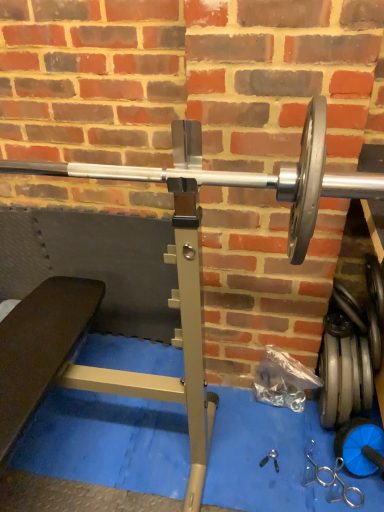
Find the location of a particular element. Image resolution: width=384 pixels, height=512 pixels. silver metallic barbell at center is located at coordinates pyautogui.click(x=241, y=175).

Can you confirm if blue rubber dumbbell at lower right, the second dumbbell viewed from the top, is shorter than silver metallic barbell at center?

Indeed, blue rubber dumbbell at lower right, the second dumbbell viewed from the top, has a lesser height compared to silver metallic barbell at center.

Where is `the 2nd dumbbell to the right of the silver metallic barbell at center, counting from the anchor's position`? the 2nd dumbbell to the right of the silver metallic barbell at center, counting from the anchor's position is located at coordinates (360, 446).

Is blue rubber dumbbell at lower right, arranged as the first dumbbell when ordered from the bottom, not inside silver metallic barbell at center?

That's correct, blue rubber dumbbell at lower right, arranged as the first dumbbell when ordered from the bottom, is outside of silver metallic barbell at center.

Between blue rubber dumbbell at lower right, arranged as the first dumbbell when ordered from the bottom, and silver metallic barbell at center, which one has smaller size?

With smaller size is blue rubber dumbbell at lower right, arranged as the first dumbbell when ordered from the bottom.

Is blue rubber dumbbell at lower right, the second dumbbell viewed from the top, positioned far away from silver metallic dumbbell at lower right, the second dumbbell ordered from the bottom?

That's not correct — blue rubber dumbbell at lower right, the second dumbbell viewed from the top, is a little close to silver metallic dumbbell at lower right, the second dumbbell ordered from the bottom.

Does blue rubber dumbbell at lower right, arranged as the first dumbbell when ordered from the bottom, have a greater width compared to silver metallic dumbbell at lower right, placed as the first dumbbell when sorted from top to bottom?

No.

From the picture: Is blue rubber dumbbell at lower right, the second dumbbell viewed from the top, oriented away from silver metallic dumbbell at lower right, the second dumbbell ordered from the bottom?

Absolutely, blue rubber dumbbell at lower right, the second dumbbell viewed from the top, is directed away from silver metallic dumbbell at lower right, the second dumbbell ordered from the bottom.

Looking at this image, is blue rubber dumbbell at lower right, the second dumbbell viewed from the top, in front of or behind silver metallic dumbbell at lower right, the second dumbbell ordered from the bottom, in the image?

Visually, blue rubber dumbbell at lower right, the second dumbbell viewed from the top, is located in front of silver metallic dumbbell at lower right, the second dumbbell ordered from the bottom.

Considering the relative sizes of silver metallic barbell at center and blue rubber dumbbell at lower right, arranged as the first dumbbell when ordered from the bottom, in the image provided, is silver metallic barbell at center smaller than blue rubber dumbbell at lower right, arranged as the first dumbbell when ordered from the bottom,?

Actually, silver metallic barbell at center might be larger than blue rubber dumbbell at lower right, arranged as the first dumbbell when ordered from the bottom.

Can you confirm if silver metallic barbell at center is shorter than blue rubber dumbbell at lower right, arranged as the first dumbbell when ordered from the bottom?

No.

From the image's perspective, which is above, silver metallic barbell at center or blue rubber dumbbell at lower right, the second dumbbell viewed from the top?

silver metallic barbell at center appears higher in the image.

Which point is more forward, (268, 186) or (377, 450)?

The point (268, 186) is more forward.

From a real-world perspective, is silver metallic dumbbell at lower right, the second dumbbell ordered from the bottom, positioned above or below silver metallic barbell at center?

In terms of real-world spatial position, silver metallic dumbbell at lower right, the second dumbbell ordered from the bottom, is below silver metallic barbell at center.

Can you confirm if silver metallic dumbbell at lower right, the second dumbbell ordered from the bottom, is smaller than silver metallic barbell at center?

Yes, silver metallic dumbbell at lower right, the second dumbbell ordered from the bottom, is smaller than silver metallic barbell at center.

Is the surface of silver metallic dumbbell at lower right, placed as the first dumbbell when sorted from top to bottom, in direct contact with silver metallic barbell at center?

silver metallic dumbbell at lower right, placed as the first dumbbell when sorted from top to bottom, is not next to silver metallic barbell at center, and they're not touching.

Considering the positions of objects silver metallic dumbbell at lower right, placed as the first dumbbell when sorted from top to bottom, and silver metallic barbell at center in the image provided, who is more to the right, silver metallic dumbbell at lower right, placed as the first dumbbell when sorted from top to bottom, or silver metallic barbell at center?

From the viewer's perspective, silver metallic dumbbell at lower right, placed as the first dumbbell when sorted from top to bottom, appears more on the right side.

Considering the relative sizes of silver metallic barbell at center and silver metallic dumbbell at lower right, placed as the first dumbbell when sorted from top to bottom, in the image provided, is silver metallic barbell at center bigger than silver metallic dumbbell at lower right, placed as the first dumbbell when sorted from top to bottom,?

Yes, silver metallic barbell at center is bigger than silver metallic dumbbell at lower right, placed as the first dumbbell when sorted from top to bottom.

Is silver metallic barbell at center far from silver metallic dumbbell at lower right, the second dumbbell ordered from the bottom?

Actually, silver metallic barbell at center and silver metallic dumbbell at lower right, the second dumbbell ordered from the bottom, are a little close together.

Does point (165, 181) appear closer or farther from the camera than point (368, 370)?

Point (165, 181) appears to be closer to the viewer than point (368, 370).

Which object is closer to the camera, silver metallic barbell at center or silver metallic dumbbell at lower right, the second dumbbell ordered from the bottom?

silver metallic barbell at center is more forward.

Is silver metallic dumbbell at lower right, placed as the first dumbbell when sorted from top to bottom, with blue rubber dumbbell at lower right, arranged as the first dumbbell when ordered from the bottom?

No, silver metallic dumbbell at lower right, placed as the first dumbbell when sorted from top to bottom, is not in contact with blue rubber dumbbell at lower right, arranged as the first dumbbell when ordered from the bottom.

Is silver metallic dumbbell at lower right, placed as the first dumbbell when sorted from top to bottom, spatially inside blue rubber dumbbell at lower right, the second dumbbell viewed from the top, or outside of it?

silver metallic dumbbell at lower right, placed as the first dumbbell when sorted from top to bottom, cannot be found inside blue rubber dumbbell at lower right, the second dumbbell viewed from the top.

Can you confirm if silver metallic dumbbell at lower right, placed as the first dumbbell when sorted from top to bottom, is bigger than blue rubber dumbbell at lower right, arranged as the first dumbbell when ordered from the bottom?

Yes, silver metallic dumbbell at lower right, placed as the first dumbbell when sorted from top to bottom, is bigger than blue rubber dumbbell at lower right, arranged as the first dumbbell when ordered from the bottom.

The width and height of the screenshot is (384, 512). Identify the location of barbell lying above the blue rubber dumbbell at lower right, arranged as the first dumbbell when ordered from the bottom (from the image's perspective). (241, 175).

Where is `dumbbell in front of the silver metallic dumbbell at lower right, placed as the first dumbbell when sorted from top to bottom`? The image size is (384, 512). dumbbell in front of the silver metallic dumbbell at lower right, placed as the first dumbbell when sorted from top to bottom is located at coordinates (360, 446).

Estimate the real-world distances between objects in this image. Which object is closer to silver metallic barbell at center, silver metallic dumbbell at lower right, placed as the first dumbbell when sorted from top to bottom, or blue rubber dumbbell at lower right, the second dumbbell viewed from the top?

The object closer to silver metallic barbell at center is silver metallic dumbbell at lower right, placed as the first dumbbell when sorted from top to bottom.

Based on their spatial positions, is blue rubber dumbbell at lower right, arranged as the first dumbbell when ordered from the bottom, or silver metallic dumbbell at lower right, the second dumbbell ordered from the bottom, further from silver metallic barbell at center?

blue rubber dumbbell at lower right, arranged as the first dumbbell when ordered from the bottom, is positioned further to the anchor silver metallic barbell at center.

Which object lies further to the anchor point blue rubber dumbbell at lower right, the second dumbbell viewed from the top, silver metallic dumbbell at lower right, placed as the first dumbbell when sorted from top to bottom, or silver metallic barbell at center?

silver metallic barbell at center is positioned further to the anchor blue rubber dumbbell at lower right, the second dumbbell viewed from the top.

Based on the photo, from the image, which object appears to be nearer to silver metallic dumbbell at lower right, the second dumbbell ordered from the bottom, silver metallic barbell at center or blue rubber dumbbell at lower right, the second dumbbell viewed from the top?

The object closer to silver metallic dumbbell at lower right, the second dumbbell ordered from the bottom, is blue rubber dumbbell at lower right, the second dumbbell viewed from the top.

When comparing their distances from silver metallic dumbbell at lower right, the second dumbbell ordered from the bottom, does blue rubber dumbbell at lower right, the second dumbbell viewed from the top, or silver metallic barbell at center seem further?

The object further to silver metallic dumbbell at lower right, the second dumbbell ordered from the bottom, is silver metallic barbell at center.

When comparing their distances from blue rubber dumbbell at lower right, arranged as the first dumbbell when ordered from the bottom, does silver metallic barbell at center or silver metallic dumbbell at lower right, the second dumbbell ordered from the bottom, seem closer?

silver metallic dumbbell at lower right, the second dumbbell ordered from the bottom, is closer to blue rubber dumbbell at lower right, arranged as the first dumbbell when ordered from the bottom.

You are a GUI agent. You are given a task and a screenshot of the screen. Output one action in this format:
    pyautogui.click(x=<x>, y=<y>)
    Task: Click on the dumbbell between silver metallic barbell at center and blue rubber dumbbell at lower right, arranged as the first dumbbell when ordered from the bottom, vertically
    This screenshot has height=512, width=384.
    Given the screenshot: What is the action you would take?
    pyautogui.click(x=351, y=354)